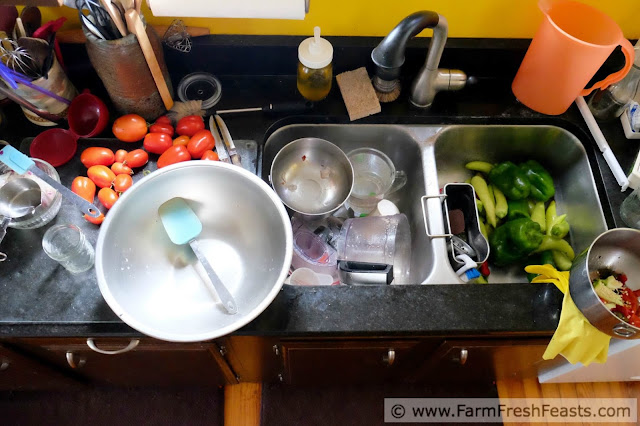
This screenshot has width=640, height=426. Find the location of `counter top`. counter top is located at coordinates (425, 314).